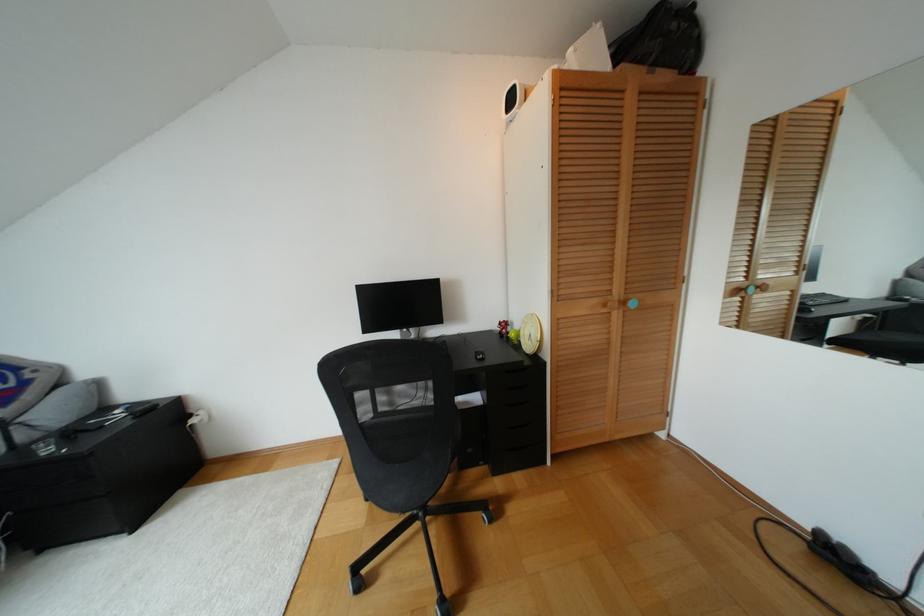
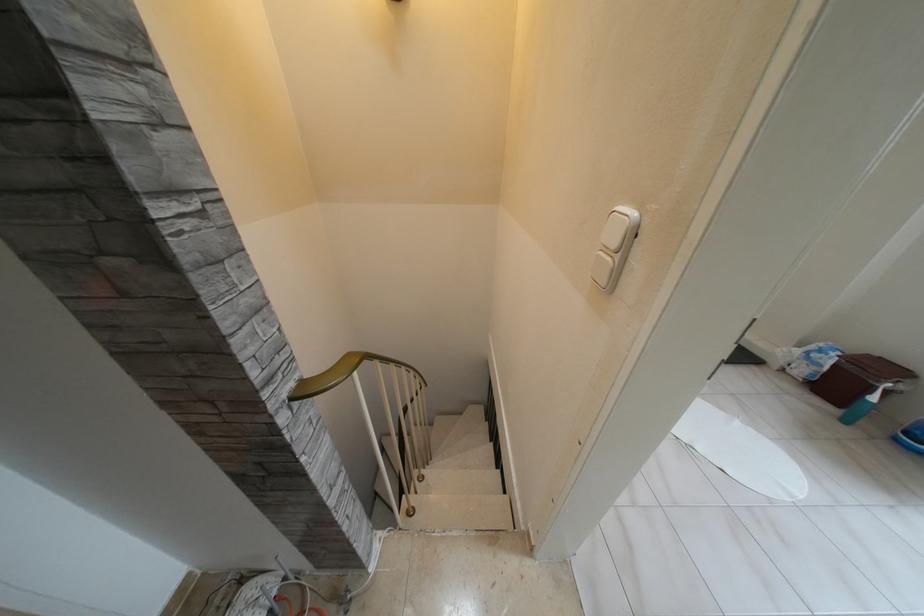
Question: What movement of the cameraman would produce the second image?

Choices:
 (A) Left
 (B) Right
 (C) Forward
 (D) Backward

Answer: (B)